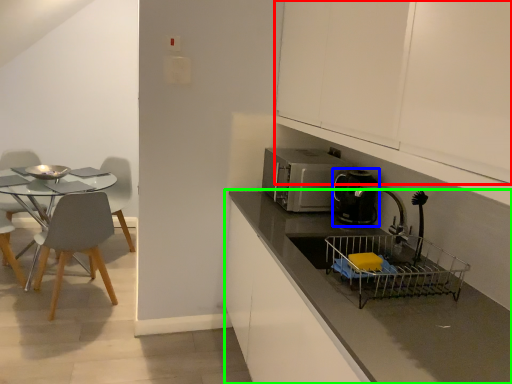
Question: Considering the real-world distances, which object is farthest from cabinetry (highlighted by a red box)? kitchen appliance (highlighted by a blue box) or countertop (highlighted by a green box)?

Choices:
 (A) kitchen appliance
 (B) countertop

Answer: (B)